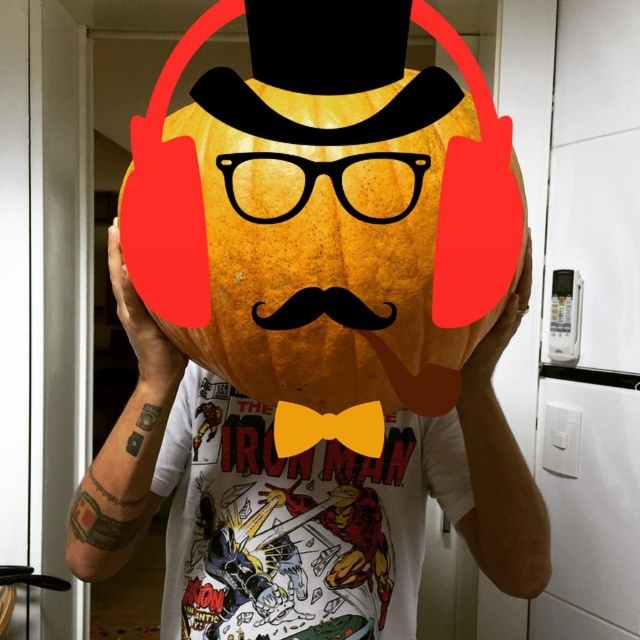
You are taking a photo of the pumpkin character in the image. You want to focus on the point that is closer to the camera. Which point should you choose between point (x=353, y=209) and point (x=307, y=424)?

You should choose point (x=353, y=209) because it is closer to the camera than point (x=307, y=424).

You are trying to take a photo of the yellow fabric bow tie at center but the orange matte pumpkin at center is blocking it. Can you see the bow tie clearly?

The orange matte pumpkin at center is positioned over yellow fabric bow tie at center, so the pumpkin is blocking the view of the bow tie. You cannot see the bow tie clearly.